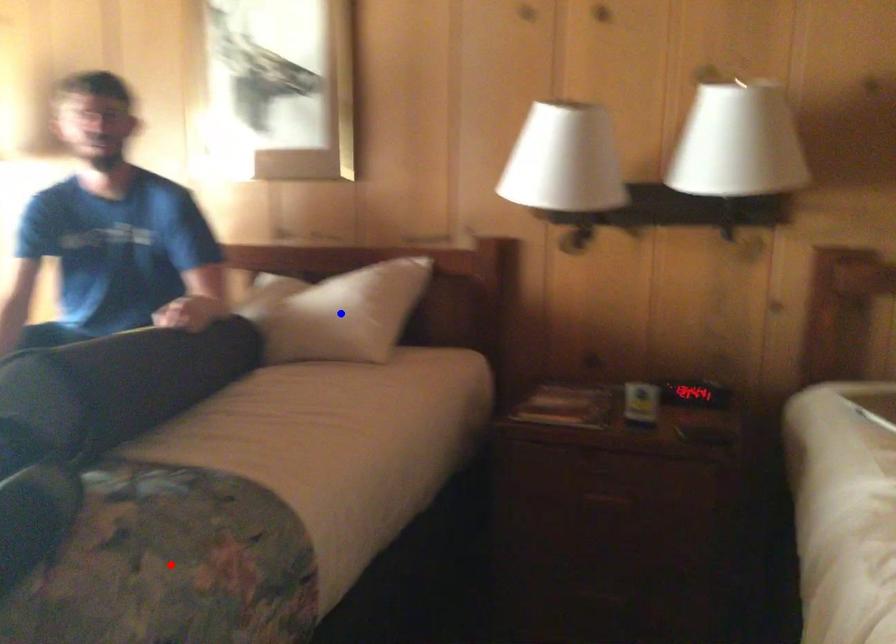
Question: In the image, two points are highlighted. Which point is nearer to the camera? Reply with the corresponding letter.

Choices:
 (A) blue point
 (B) red point

Answer: (B)